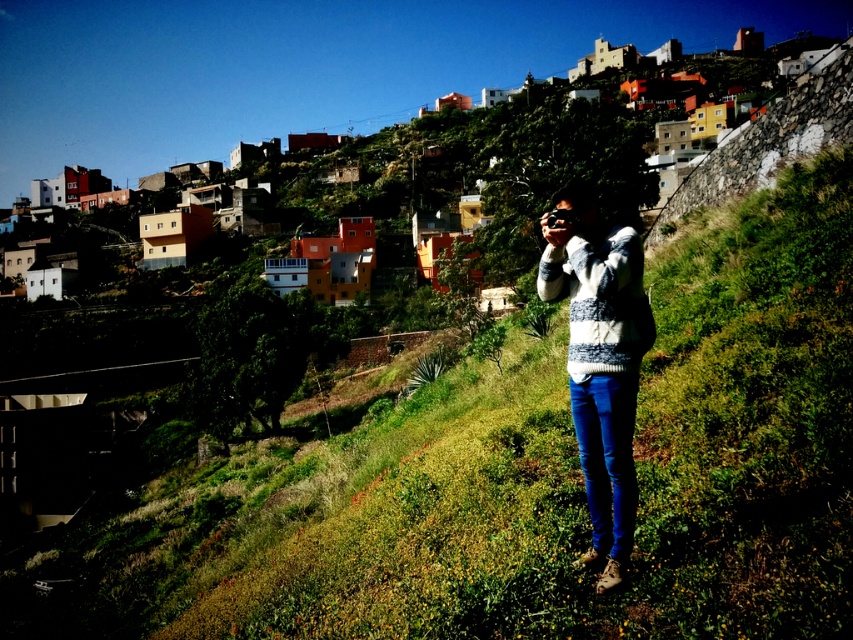
You are a fashion photographer trying to capture the outfit of the person in the image. The knitted sweater at center and blue denim jeans at center are part of their outfit. To ensure the sweater is visible in the photo, should you adjust your camera to focus more on the left or right side of the person?

The knitted sweater at center is to the right of blue denim jeans at center, so focusing on the right side of the person would ensure the sweater is visible.

You are a photographer trying to capture the vibrant hillside town in the background. You notice the knitted sweater at center and the blue denim jeans at center. Which item will appear larger in your photo?

The knitted sweater at center will appear larger in the photo because it is closer to the viewer than the blue denim jeans at center.